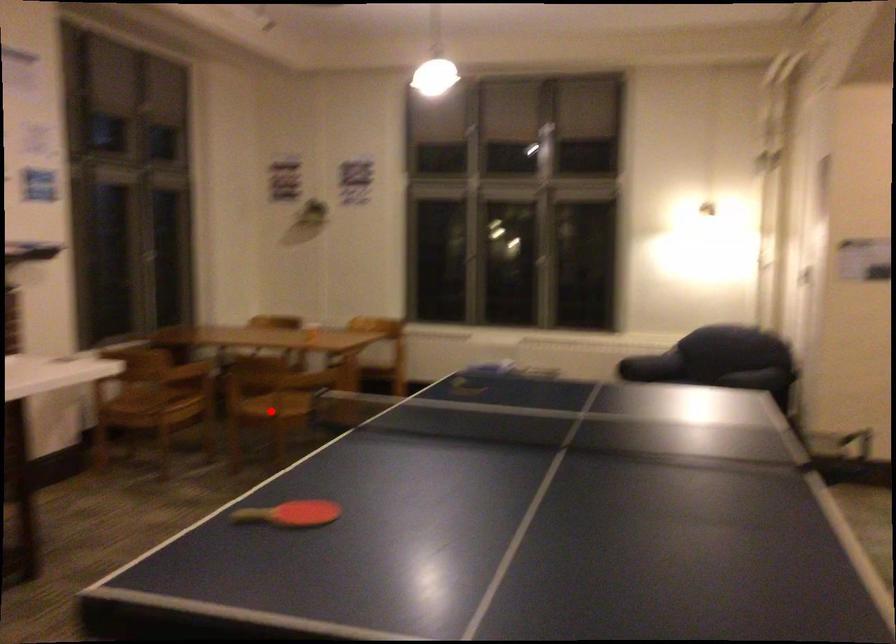
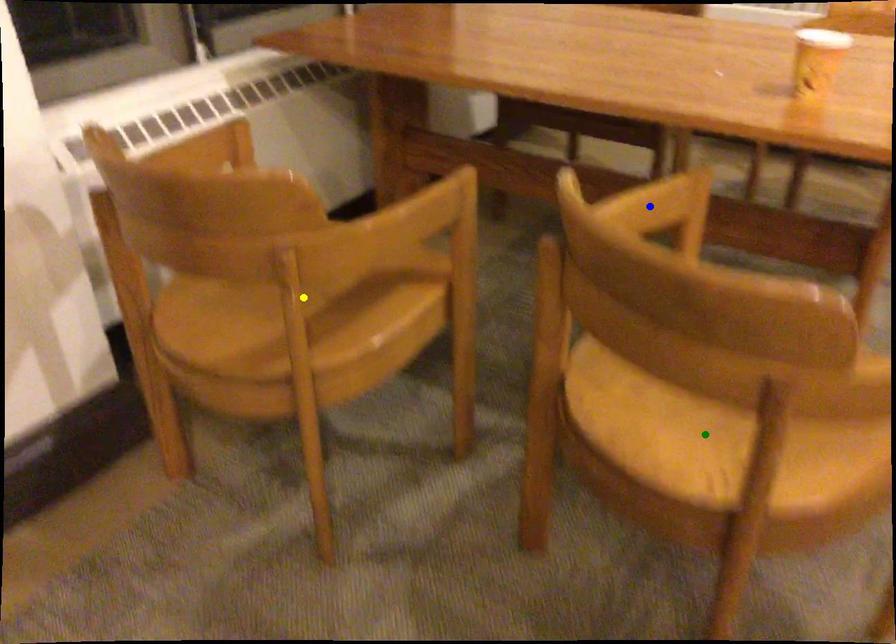
Question: I am providing you with two images of the same scene from different viewpoints. A red point is marked on the first image. You are given multiple points on the second image. Which mark in image 2 goes with the point in image 1?

Choices:
 (A) green point
 (B) yellow point
 (C) blue point

Answer: (A)